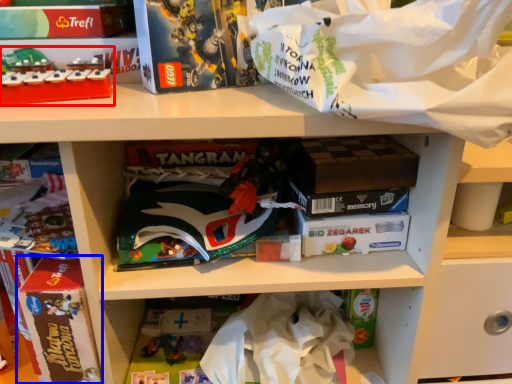
Question: Among these objects, which one is nearest to the camera, toy (highlighted by a red box) or paperback book (highlighted by a blue box)?

Choices:
 (A) toy
 (B) paperback book

Answer: (A)